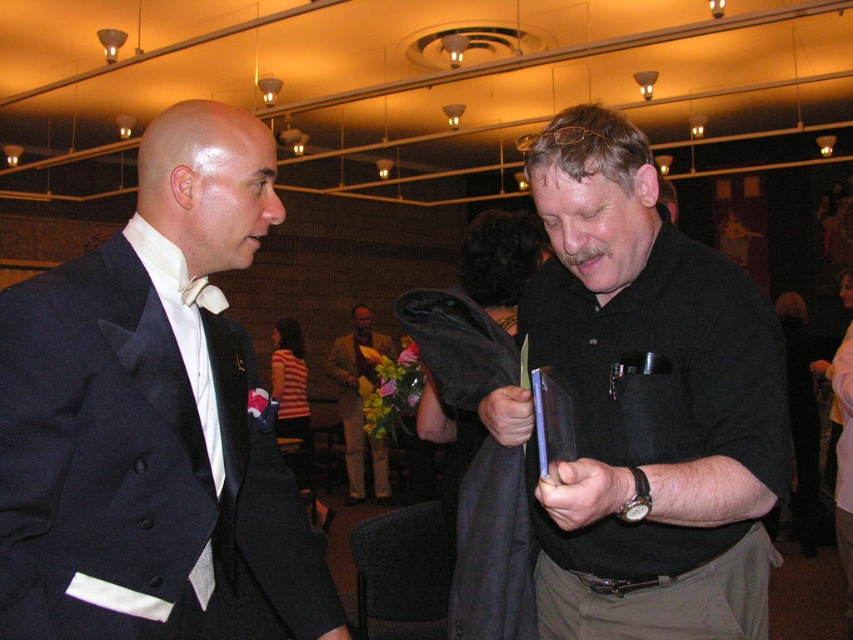
Is matte black suit at left to the left of yellow textured suit at center from the viewer's perspective?

Incorrect, matte black suit at left is not on the left side of yellow textured suit at center.

Who is positioned more to the right, matte black suit at left or yellow textured suit at center?

matte black suit at left

Who is more distant from viewer, (223, 499) or (341, 410)?

The point (341, 410) is behind.

Find the location of a particular element. This screenshot has height=640, width=853. matte black suit at left is located at coordinates coord(149,413).

Is point (761, 384) less distant than point (361, 330)?

Yes.

Between point (601, 529) and point (381, 337), which one is positioned behind?

Point (381, 337)

What are the coordinates of `black matte shirt at center` in the screenshot? It's located at (648, 403).

Does matte black suit at left have a lesser width compared to black matte shirt at center?

Correct, matte black suit at left's width is less than black matte shirt at center's.

Who is more forward, (144, 440) or (723, 428)?

Positioned in front is point (723, 428).

Does point (294, 592) come closer to viewer compared to point (718, 452)?

No.

Where is `matte black suit at left`? The image size is (853, 640). matte black suit at left is located at coordinates (149, 413).